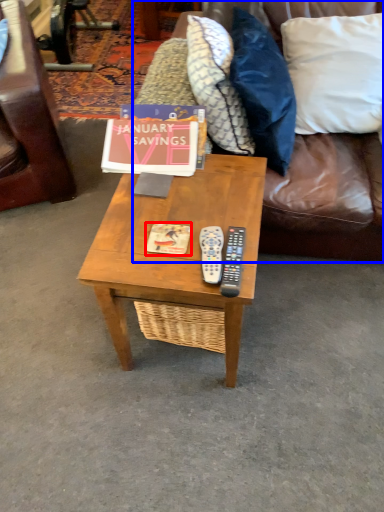
Question: Which of the following is the closest to the observer, magazine (highlighted by a red box) or studio couch (highlighted by a blue box)?

Choices:
 (A) magazine
 (B) studio couch

Answer: (B)